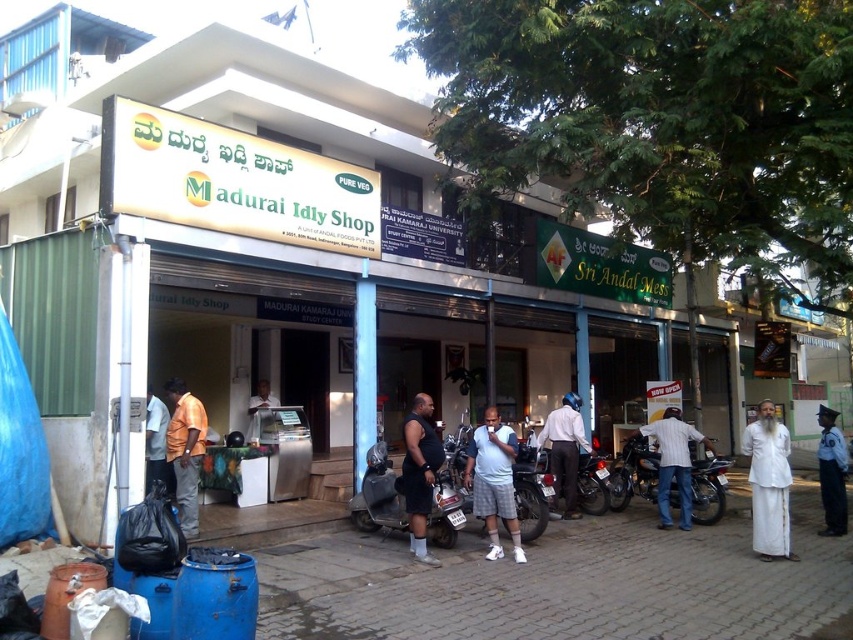
You are standing at the entrance of Madurai Idly Shop. You see a metallic silver scooter at center. Where is the point located at coordinate (379, 493)?

The point at coordinate (379, 493) is on the metallic silver scooter at center.